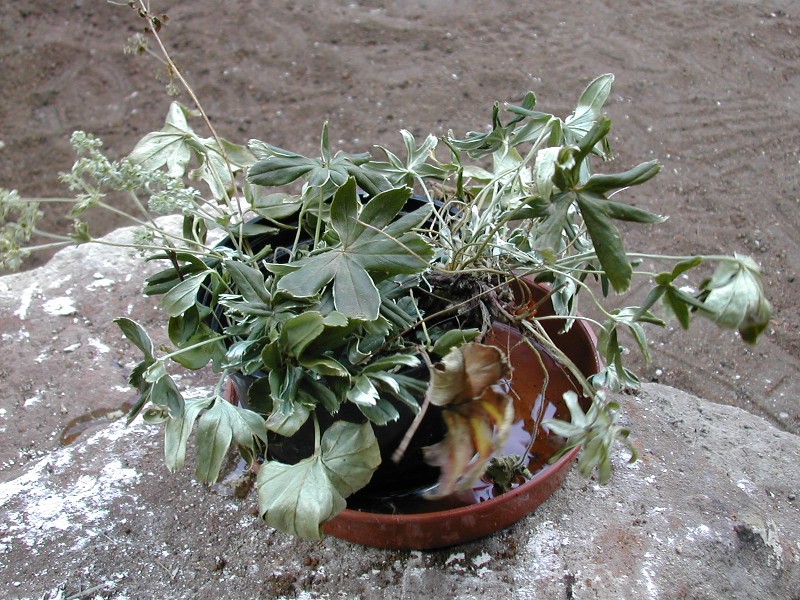
Identify the location of plastic brown plant container. (546, 480).